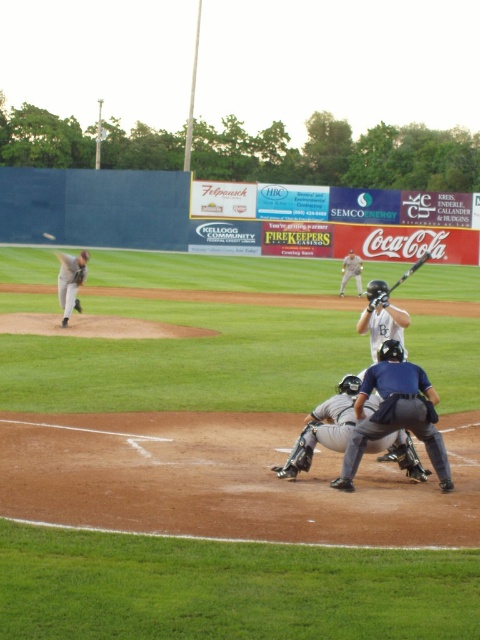
Between gray uniformed pitcher at left and white matte baseball at center, which one appears on the left side from the viewer's perspective?

From the viewer's perspective, white matte baseball at center appears more on the left side.

Does gray uniformed pitcher at left appear on the left side of white matte baseball at center?

No, gray uniformed pitcher at left is not to the left of white matte baseball at center.

Is point (67, 272) less distant than point (55, 236)?

Yes.

Locate an element on the screen. The height and width of the screenshot is (640, 480). gray uniformed pitcher at left is located at coordinates (71, 282).

Is white uniformed player at center thinner than white matte baseball at center?

In fact, white uniformed player at center might be wider than white matte baseball at center.

Which is behind, point (350, 269) or point (45, 232)?

Point (45, 232)

Which is in front, point (343, 294) or point (46, 232)?

Point (343, 294)

Locate an element on the screen. The height and width of the screenshot is (640, 480). white uniformed player at center is located at coordinates (350, 272).

Is white matte baseball bat at center below white matte baseball at center?

Yes, white matte baseball bat at center is below white matte baseball at center.

Is white matte baseball bat at center closer to camera compared to white matte baseball at center?

Yes, it is in front of white matte baseball at center.

Which is in front, point (364, 330) or point (51, 236)?

Point (364, 330) is more forward.

What are the coordinates of `white matte baseball bat at center` in the screenshot? It's located at (382, 321).